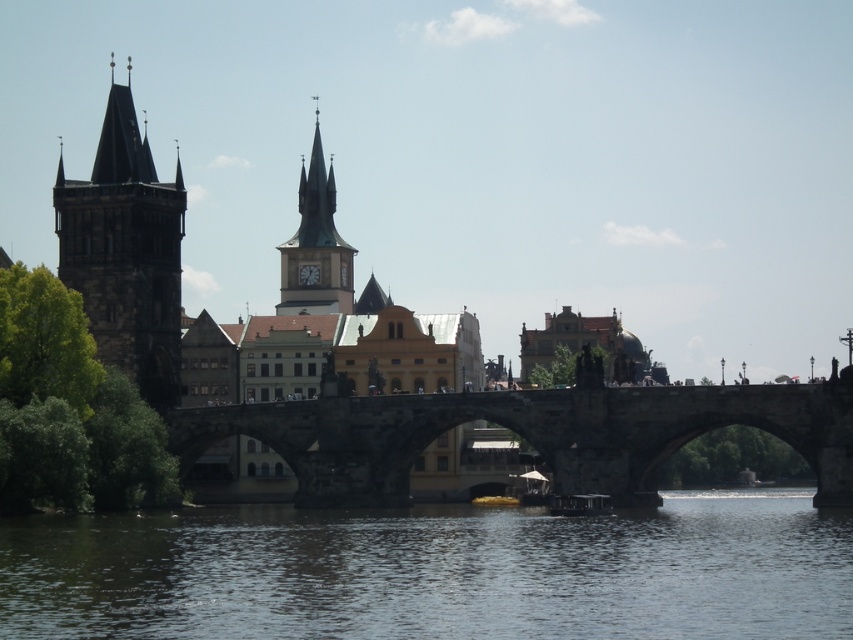
Question: Can you confirm if dark stone tower at left is positioned below smooth stone clock tower at center?

Choices:
 (A) no
 (B) yes

Answer: (B)

Question: Is the position of transparent water at lower center less distant than that of brown stone bridge at center?

Choices:
 (A) no
 (B) yes

Answer: (B)

Question: Which object is the closest to the dark stone tower at left?

Choices:
 (A) transparent water at lower center
 (B) brown stone bridge at center

Answer: (B)

Question: Is brown stone bridge at center wider than smooth stone clock tower at center?

Choices:
 (A) yes
 (B) no

Answer: (A)

Question: Which point is farther from the camera taking this photo?

Choices:
 (A) (679, 408)
 (B) (695, 509)
 (C) (144, 227)

Answer: (C)

Question: Among these points, which one is nearest to the camera?

Choices:
 (A) (656, 465)
 (B) (300, 260)

Answer: (A)